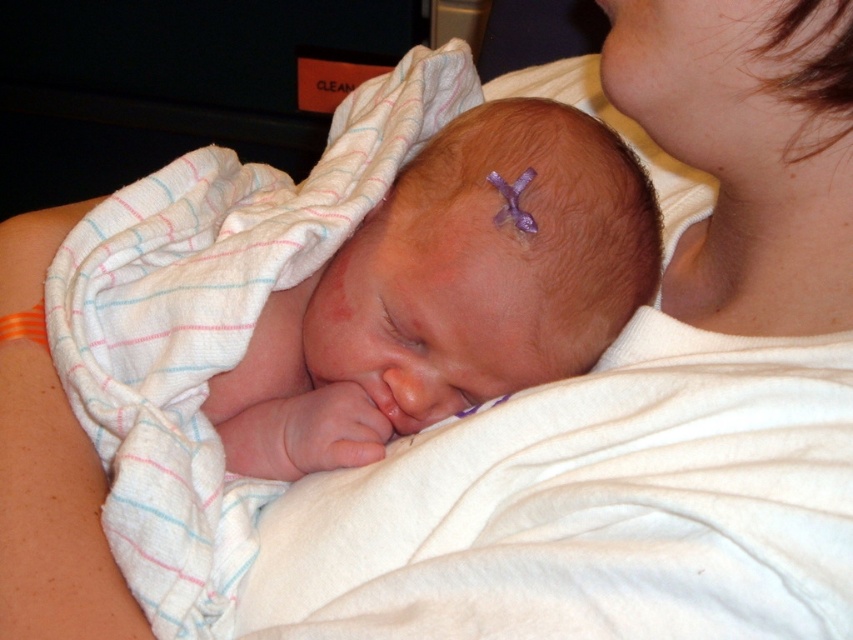
Question: Does smooth skin newborn at center come in front of orange fabric at lower left?

Choices:
 (A) yes
 (B) no

Answer: (B)

Question: Which object is closer to the camera taking this photo?

Choices:
 (A) orange fabric at lower left
 (B) smooth skin newborn at center

Answer: (A)

Question: Is smooth skin newborn at center to the left of orange fabric at lower left from the viewer's perspective?

Choices:
 (A) yes
 (B) no

Answer: (B)

Question: Which object is farther from the camera taking this photo?

Choices:
 (A) orange fabric at lower left
 (B) smooth skin newborn at center

Answer: (B)

Question: Can you confirm if smooth skin newborn at center is wider than orange fabric at lower left?

Choices:
 (A) no
 (B) yes

Answer: (B)